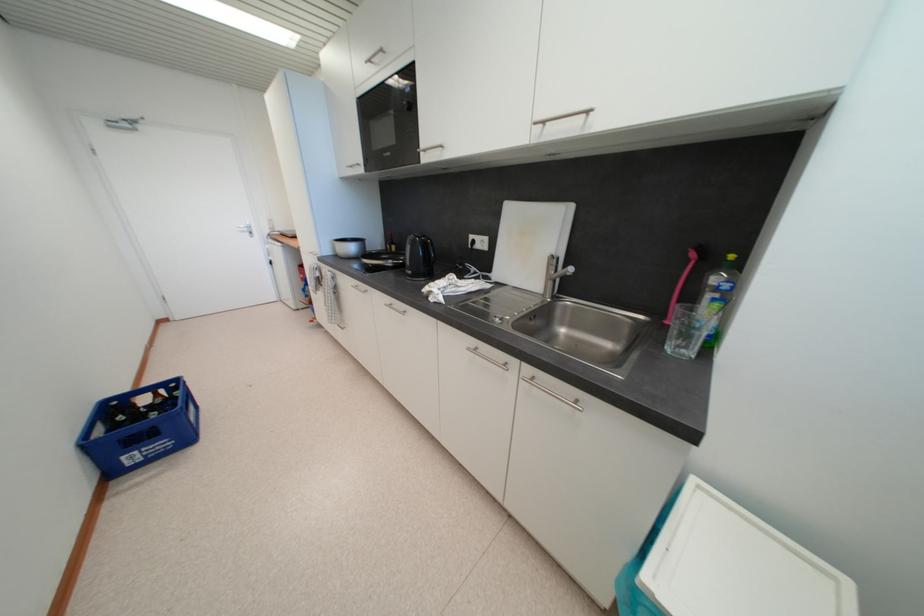
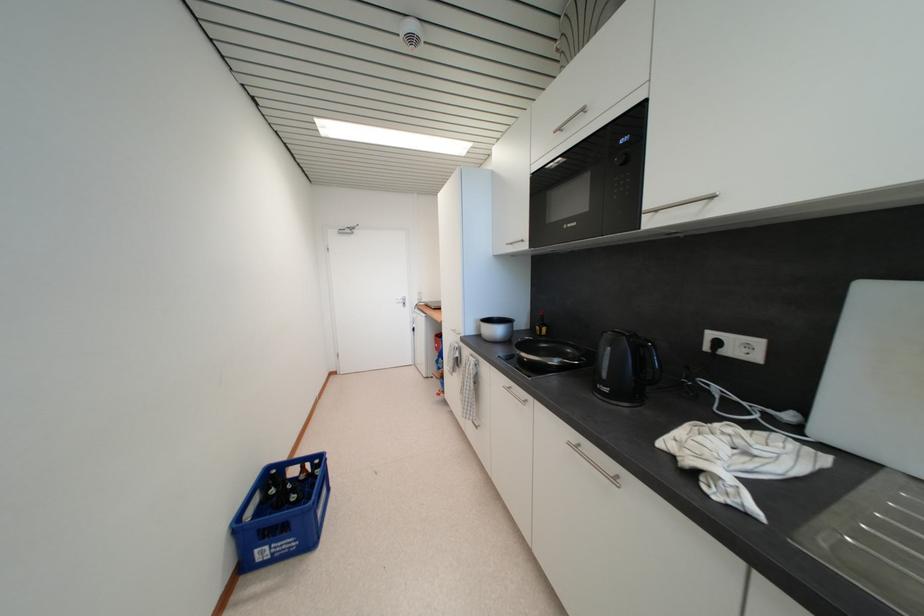
Question: The camera is either moving clockwise (left) or counter-clockwise (right) around the object. The first image is from the beginning of the video and the second image is from the end. Is the camera moving left or right when shooting the video?

Choices:
 (A) Left
 (B) Right

Answer: (B)